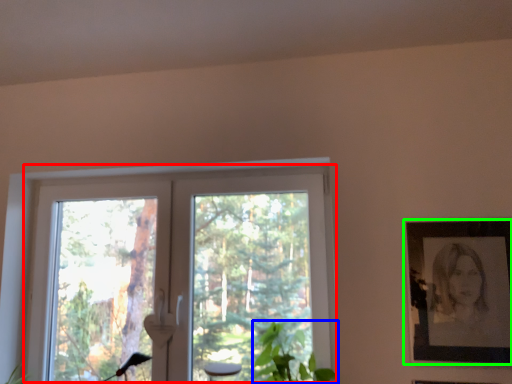
Question: Which object is the closest to the window (highlighted by a red box)? Choose among these: plant (highlighted by a blue box) or picture frame (highlighted by a green box).

Choices:
 (A) plant
 (B) picture frame

Answer: (A)